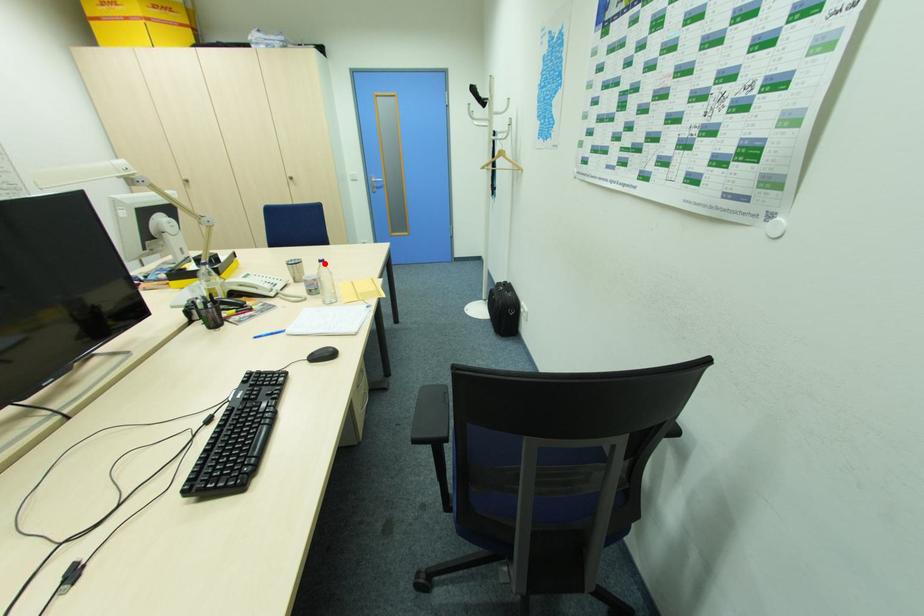
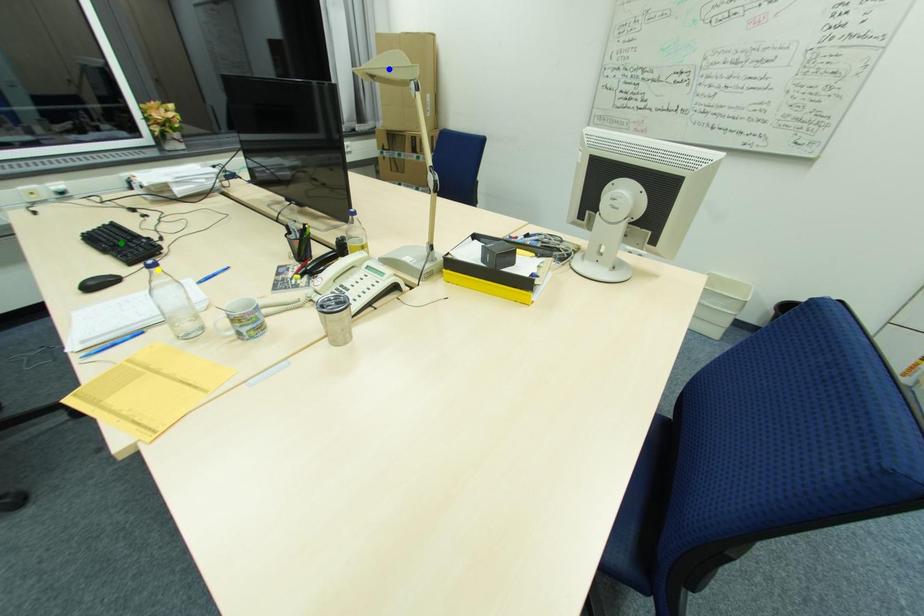
Question: I am providing you with two images of the same scene from different viewpoints. A red point is marked on the first image. You are given multiple points on the second image. Which point in image 2 represents the same 3d spot as the red point in image 1?

Choices:
 (A) blue point
 (B) green point
 (C) yellow point

Answer: (C)